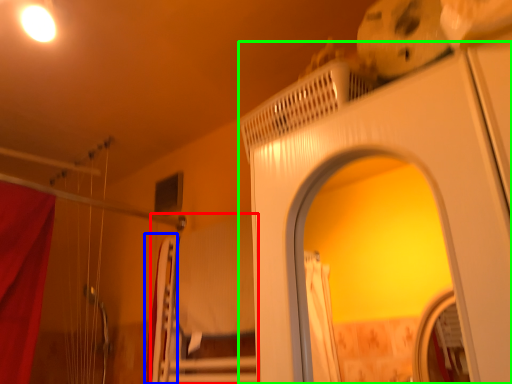
Question: Which is nearer to the bed (highlighted by a red box)? curtain (highlighted by a blue box) or screen door (highlighted by a green box).

Choices:
 (A) curtain
 (B) screen door

Answer: (A)